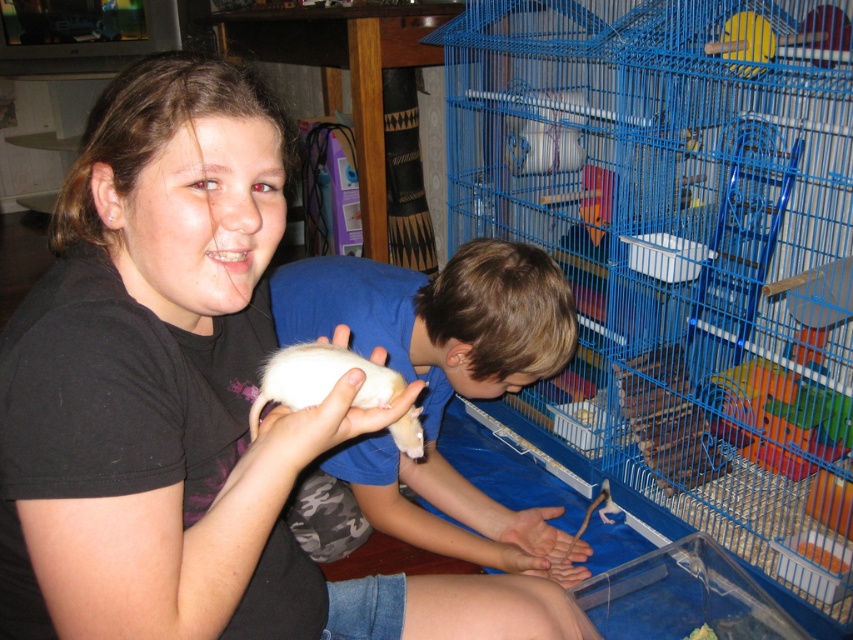
You are a photographer trying to capture a clear photo of the blue wire cage at lower right and the matte black shirt at upper left. Since you want both objects in focus, you need to know which one is bigger. Which object is larger?

The blue wire cage at lower right is larger in size than the matte black shirt at upper left, so you should focus on the blue wire cage at lower right to ensure both are in focus.

You are a photographer standing in front of the cage. You want to take a closeup photo of the mouse near point (61, 244) and point (430, 323). Which point should you focus on to capture the mouse in the foreground?

You should focus on point (61, 244) because it is closer to the viewer than point (430, 323), making it the foreground position.

You are a parent supervising two children playing with small animals in a blue cage. You notice both the white fur coat at center and the white soft hamster at center. Which object is closer to you?

The white fur coat at center is closer to you than the white soft hamster at center.